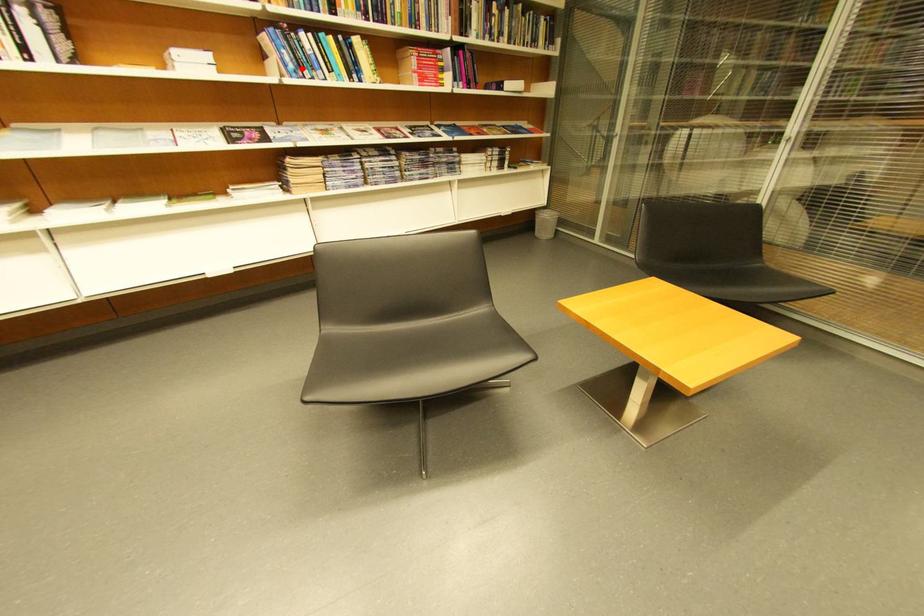
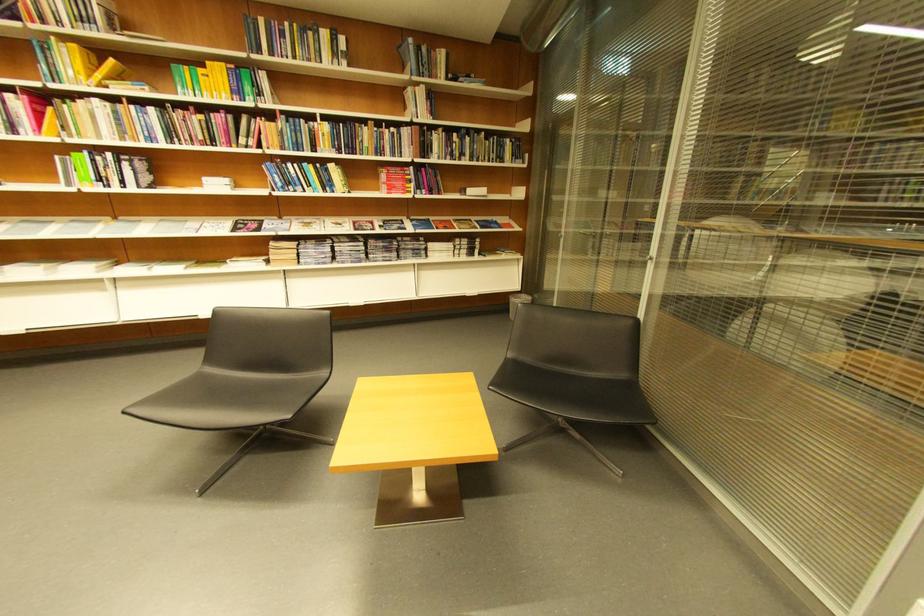
The point at the highlighted location is marked in the first image. Where is the corresponding point in the second image?

(290, 185)